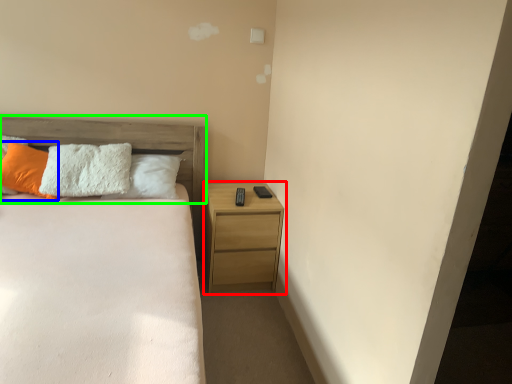
Question: Estimate the real-world distances between objects in this image. Which object is closer to nightstand (highlighted by a red box), pillow (highlighted by a blue box) or headboard (highlighted by a green box)?

Choices:
 (A) pillow
 (B) headboard

Answer: (B)